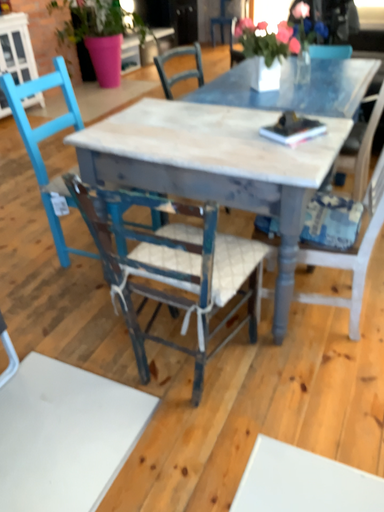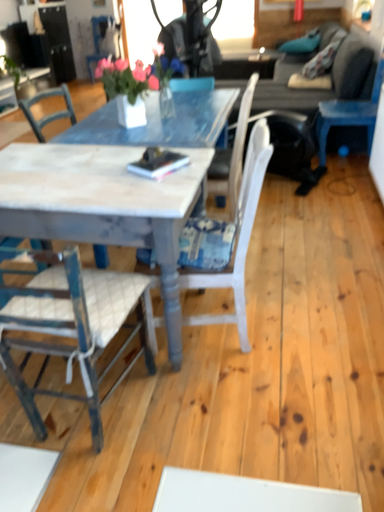
Question: Which way did the camera rotate in the video?

Choices:
 (A) rotated left
 (B) rotated right

Answer: (B)